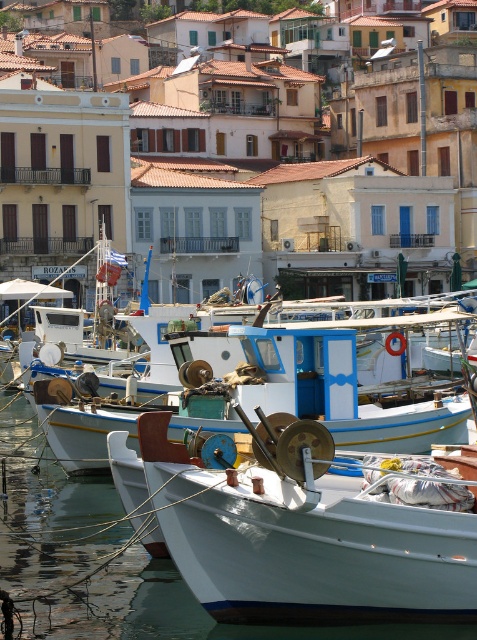
You are a tour guide leading a group of visitors to the waterfront. You want to ensure that a 15 meter long tour bus can pass between the white matte boat at center and the white painted wood boat at center. Can the tour bus fit through the space between them?

The distance between the white matte boat at center and the white painted wood boat at center is 17.21 meters, which is greater than the 15 meter length of the tour bus. Therefore, the tour bus can safely pass through the space between them.

You are a tourist standing on the pier and want to take a photo of both the white matte boat at center and the white painted wood boat at center. Which boat should you move closer to in order to capture both in the same frame?

You should move closer to the white painted wood boat at center because the white matte boat at center is positioned under it, so moving closer to the upper boat will allow both to be in the frame.

You are a harbor inspector checking the boats. You need to determine which boat is shorter between the white matte boat at center and the white painted wood boat at center. Which one is shorter?

The white matte boat at center is shorter than the white painted wood boat at center.